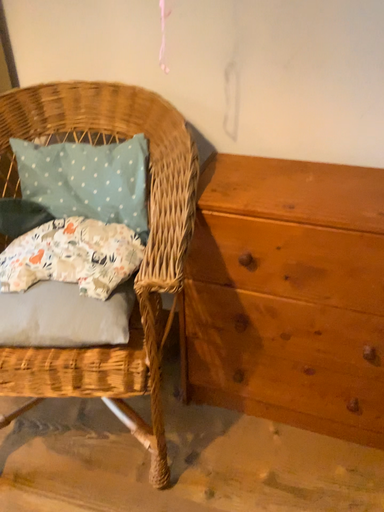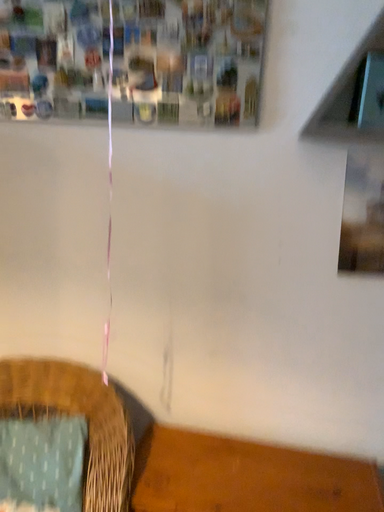
Question: How did the camera likely rotate when shooting the video?

Choices:
 (A) rotated downward
 (B) rotated upward

Answer: (B)